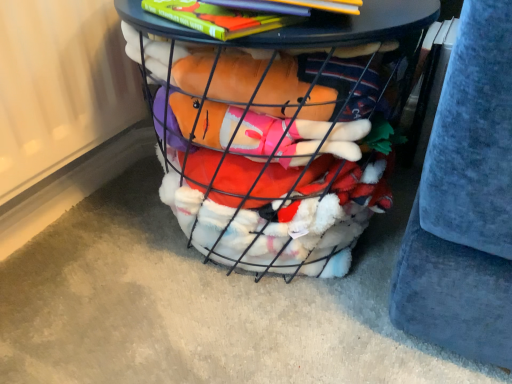
Question: Visually, is wire mesh basket at center positioned to the left or to the right of velvety blue cushion at right?

Choices:
 (A) left
 (B) right

Answer: (A)

Question: From the image's perspective, relative to velvety blue cushion at right, is wire mesh basket at center above or below?

Choices:
 (A) above
 (B) below

Answer: (B)

Question: Which is nearer to the hardcover book at upper center?

Choices:
 (A) wire mesh basket at center
 (B) velvety blue cushion at right

Answer: (A)

Question: Which of these objects is positioned closest to the wire mesh basket at center?

Choices:
 (A) hardcover book at upper center
 (B) velvety blue cushion at right

Answer: (A)